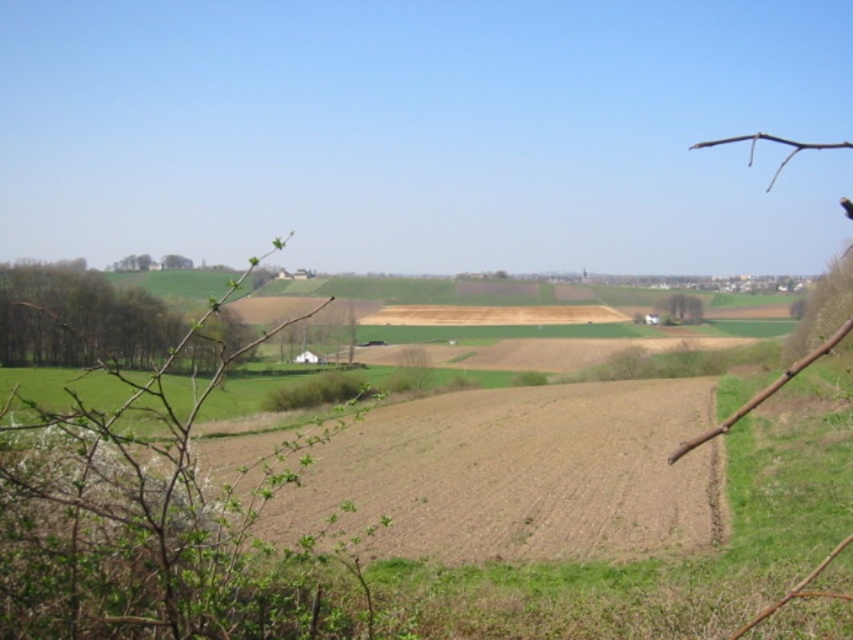
Question: Can you confirm if green leafy branch at left is positioned to the right of green leafy tree at right?

Choices:
 (A) no
 (B) yes

Answer: (A)

Question: Is green leafy branch at left below green leafy tree at right?

Choices:
 (A) yes
 (B) no

Answer: (A)

Question: Which point is farther to the camera?

Choices:
 (A) green leafy tree at right
 (B) brown soil at center

Answer: (A)

Question: Estimate the real-world distances between objects in this image. Which object is farther from the brown soil at center?

Choices:
 (A) green leafy branch at left
 (B) green leafy tree at right

Answer: (B)

Question: Among these objects, which one is nearest to the camera?

Choices:
 (A) green leafy tree at right
 (B) brown soil at center

Answer: (B)

Question: Where is green leafy branch at left located in relation to brown soil at center in the image?

Choices:
 (A) right
 (B) left

Answer: (B)